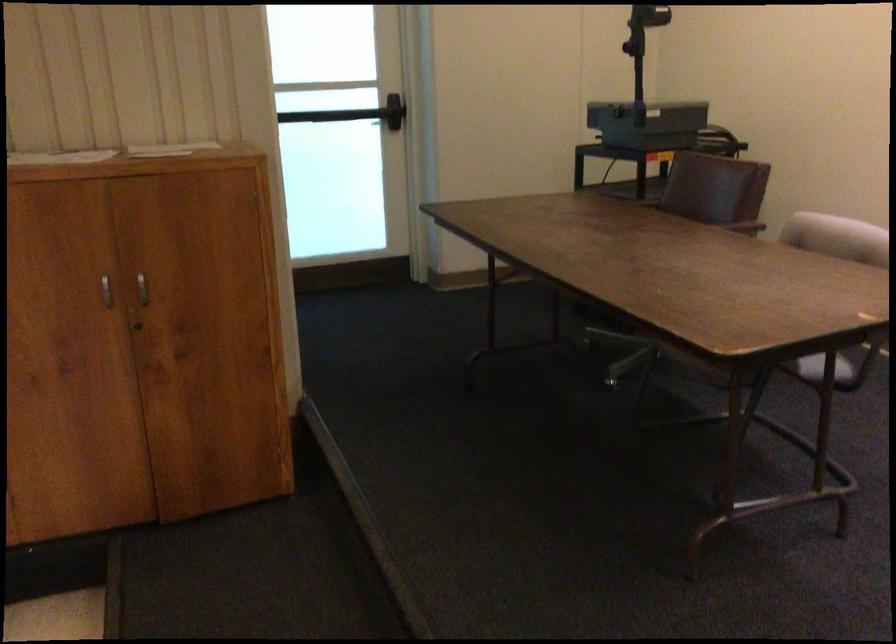
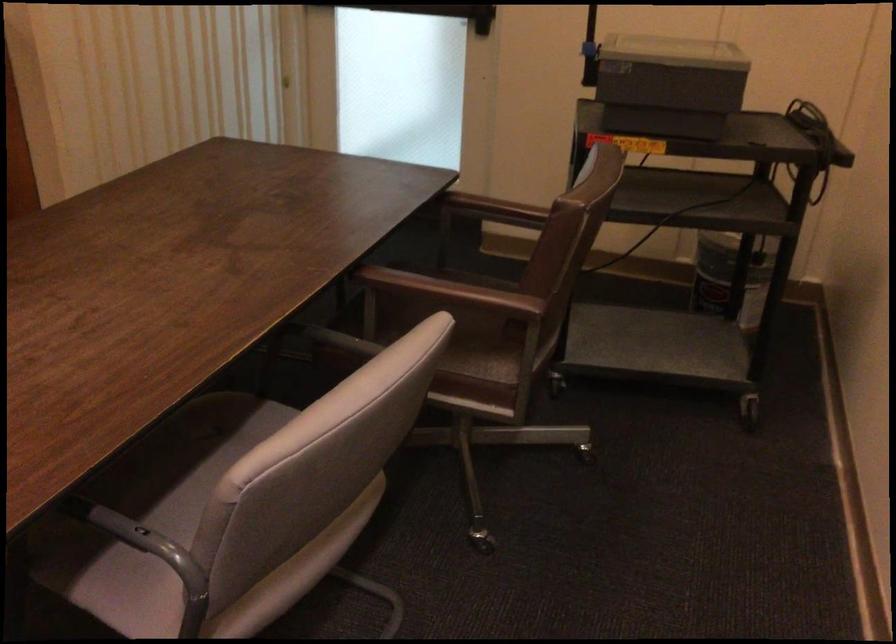
Where in the second image is the point corresponding to (x=666, y=120) from the first image?

(668, 84)